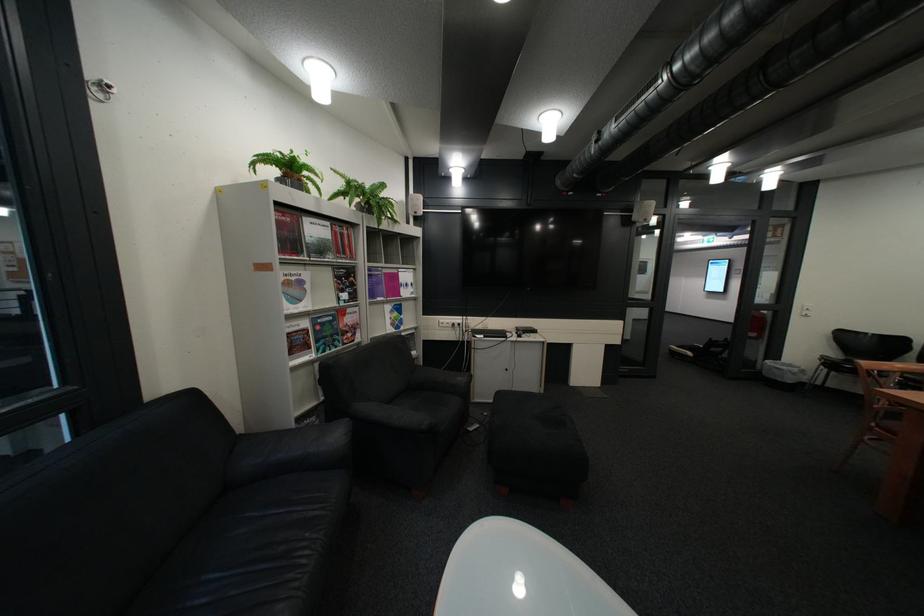
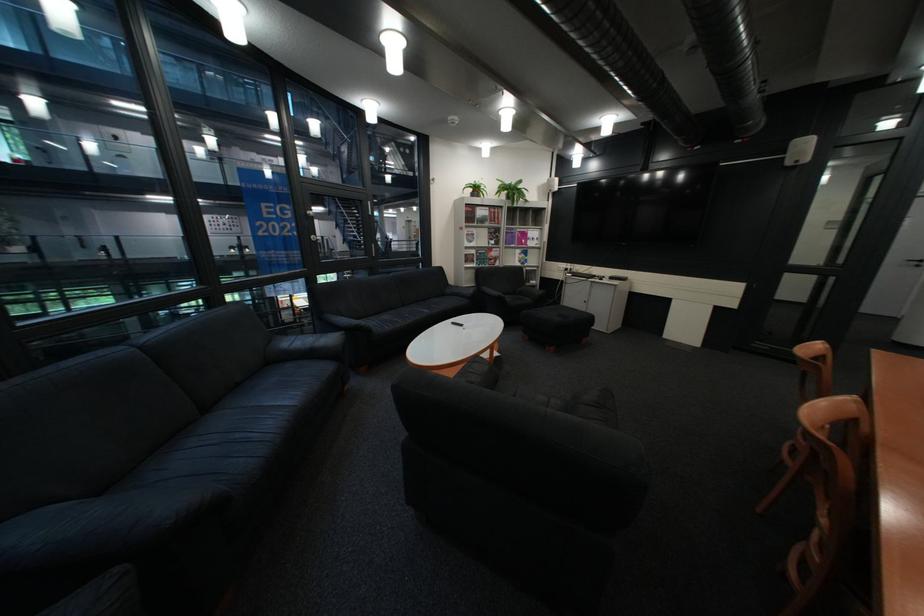
Find the pixel in the second image that matches point 292,204 in the first image.

(481, 205)